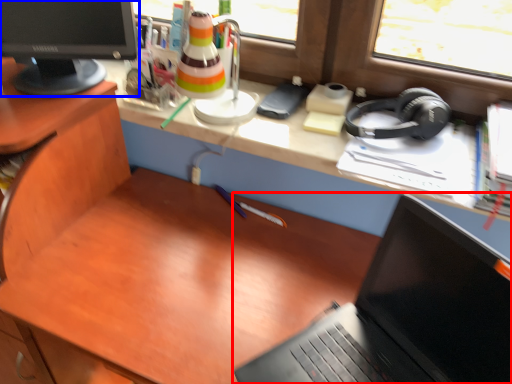
Question: Which object is further to the camera taking this photo, laptop (highlighted by a red box) or computer monitor (highlighted by a blue box)?

Choices:
 (A) laptop
 (B) computer monitor

Answer: (B)